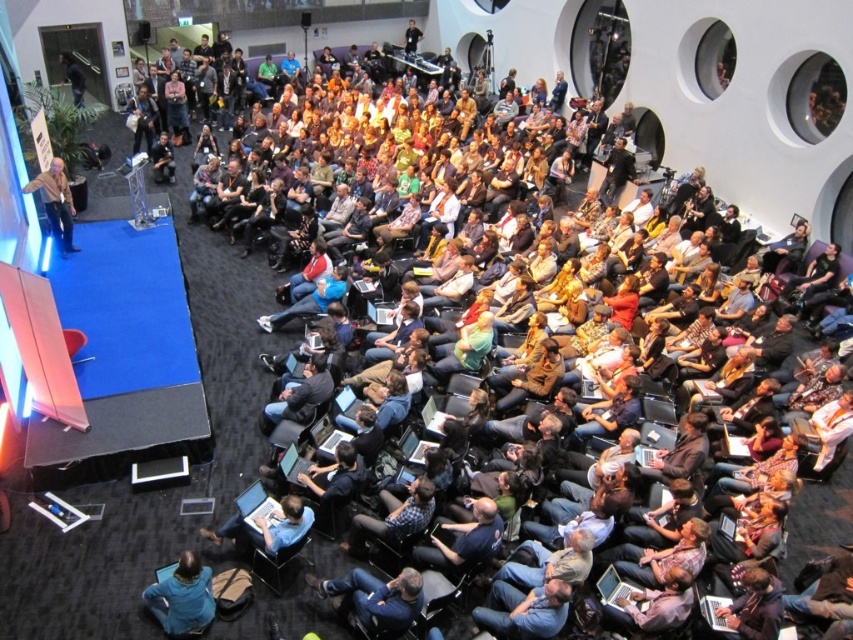
Question: Which object appears closest to the camera in this image?

Choices:
 (A) dark brown leather jacket at lower right
 (B) blue fabric jacket at lower left

Answer: (A)

Question: Can you confirm if blue fabric jacket at lower left is bigger than light brown leather jacket at left?

Choices:
 (A) no
 (B) yes

Answer: (A)

Question: Considering the real-world distances, which object is closest to the dark brown leather jacket at lower right?

Choices:
 (A) plaid shirt at center
 (B) dark blue shirt at center

Answer: (B)

Question: Where is blue denim jeans at lower center located in relation to dark brown leather jacket at lower right in the image?

Choices:
 (A) right
 (B) left

Answer: (B)

Question: Is blue denim jeans at lower center positioned at the back of light brown leather jacket at left?

Choices:
 (A) yes
 (B) no

Answer: (B)

Question: Which object is positioned farthest from the dark brown leather jacket at lower right?

Choices:
 (A) blue fabric jacket at lower left
 (B) light brown leather jacket at left
 (C) dark blue shirt at center

Answer: (B)